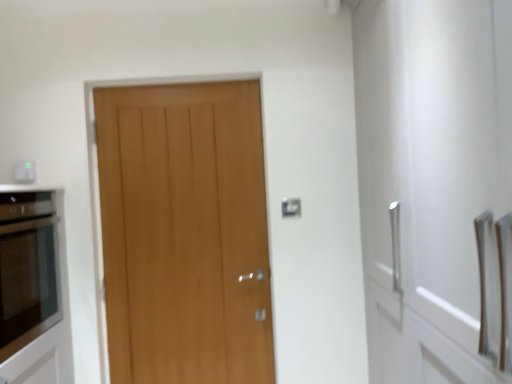
What do you see at coordinates (34, 287) in the screenshot? The height and width of the screenshot is (384, 512). I see `matte glass oven at left` at bounding box center [34, 287].

Image resolution: width=512 pixels, height=384 pixels. Identify the location of wooden door at center. (185, 233).

From the image's perspective, which is above, white plastic electric outlet at upper left or wooden door at center?

white plastic electric outlet at upper left is shown above in the image.

Is white plastic electric outlet at upper left located outside wooden door at center?

Absolutely, white plastic electric outlet at upper left is external to wooden door at center.

From a real-world perspective, who is located higher, white plastic electric outlet at upper left or wooden door at center?

white plastic electric outlet at upper left, from a real-world perspective.

Can you confirm if matte glass oven at left is positioned to the right of wooden door at center?

No.

Is matte glass oven at left not near wooden door at center?

No.

Is matte glass oven at left further to camera compared to wooden door at center?

No, it is not.

How much distance is there between matte glass oven at left and wooden door at center?

matte glass oven at left and wooden door at center are 19.37 inches apart.

How many degrees apart are the facing directions of matte glass oven at left and white plastic electric outlet at upper left?

The angle between the facing direction of matte glass oven at left and the facing direction of white plastic electric outlet at upper left is 90 degrees.

The height and width of the screenshot is (384, 512). Find the location of `appliance below the white plastic electric outlet at upper left (from a real-world perspective)`. appliance below the white plastic electric outlet at upper left (from a real-world perspective) is located at coordinates (34, 287).

Is white plastic electric outlet at upper left at the back of matte glass oven at left?

No, matte glass oven at left's orientation is not away from white plastic electric outlet at upper left.

Measure the distance between matte glass oven at left and white plastic electric outlet at upper left.

matte glass oven at left and white plastic electric outlet at upper left are 19.72 inches apart.

Which of these two, wooden door at center or white plastic electric outlet at upper left, stands shorter?

Standing shorter between the two is white plastic electric outlet at upper left.

Is wooden door at center positioned far away from white plastic electric outlet at upper left?

No.

Looking at this image, how different are the orientations of wooden door at center and white plastic electric outlet at upper left in degrees?

wooden door at center and white plastic electric outlet at upper left are facing 1.16 degrees away from each other.

Considering the sizes of objects wooden door at center and white plastic electric outlet at upper left in the image provided, who is thinner, wooden door at center or white plastic electric outlet at upper left?

white plastic electric outlet at upper left is thinner.

Looking at their sizes, would you say white plastic electric outlet at upper left is wider or thinner than matte glass oven at left?

white plastic electric outlet at upper left is thinner than matte glass oven at left.

From a real-world perspective, which is physically below, white plastic electric outlet at upper left or matte glass oven at left?

In real-world perspective, matte glass oven at left is lower.

Is white plastic electric outlet at upper left behind matte glass oven at left?

Yes, white plastic electric outlet at upper left is behind matte glass oven at left.

Can matte glass oven at left be found inside white plastic electric outlet at upper left?

Definitely not — matte glass oven at left is not inside white plastic electric outlet at upper left.

Is point (215, 243) closer to viewer compared to point (4, 347)?

No, it is not.

In the image, is wooden door at center on the left side or the right side of matte glass oven at left?

wooden door at center is to the right of matte glass oven at left.

Looking at this image, from a real-world perspective, who is located lower, wooden door at center or matte glass oven at left?

matte glass oven at left.

In the scene shown: Which of these two, wooden door at center or matte glass oven at left, is bigger?

With larger size is matte glass oven at left.

This screenshot has width=512, height=384. Identify the location of electric outlet lying above the wooden door at center (from the image's perspective). (25, 171).

Locate an element on the screen. The height and width of the screenshot is (384, 512). appliance on the left of wooden door at center is located at coordinates (34, 287).

Which object lies nearer to the anchor point matte glass oven at left, wooden door at center or white plastic electric outlet at upper left?

wooden door at center is closer to matte glass oven at left.

Based on their spatial positions, is wooden door at center or matte glass oven at left further from white plastic electric outlet at upper left?

The object further to white plastic electric outlet at upper left is wooden door at center.

When comparing their distances from matte glass oven at left, does white plastic electric outlet at upper left or wooden door at center seem closer?

wooden door at center.

Based on their spatial positions, is matte glass oven at left or white plastic electric outlet at upper left further from wooden door at center?

white plastic electric outlet at upper left is positioned further to the anchor wooden door at center.

Which object lies further to the anchor point wooden door at center, white plastic electric outlet at upper left or matte glass oven at left?

Among the two, white plastic electric outlet at upper left is located further to wooden door at center.

When comparing their distances from white plastic electric outlet at upper left, does matte glass oven at left or wooden door at center seem closer?

matte glass oven at left.

Locate an element on the screen. The width and height of the screenshot is (512, 384). appliance situated between white plastic electric outlet at upper left and wooden door at center from left to right is located at coordinates (34, 287).